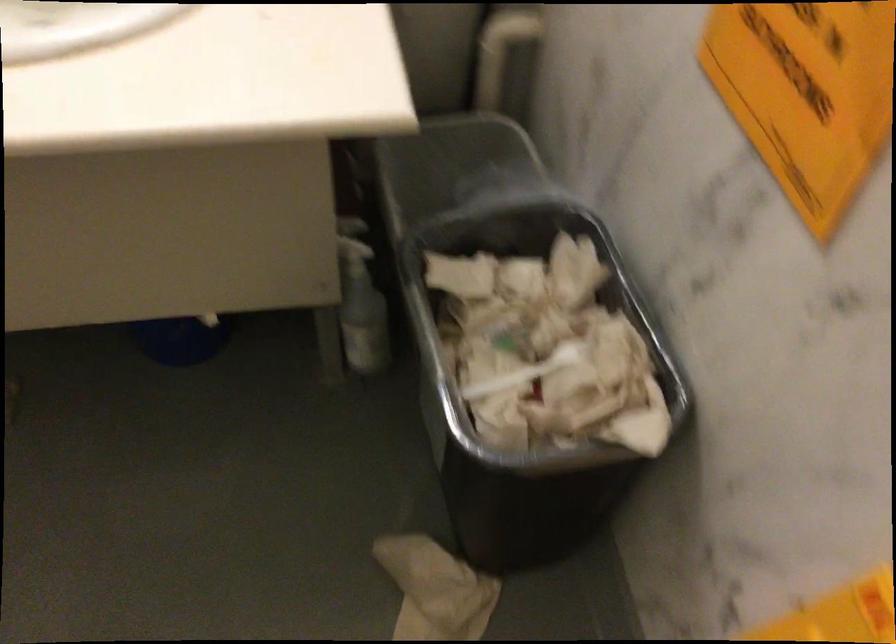
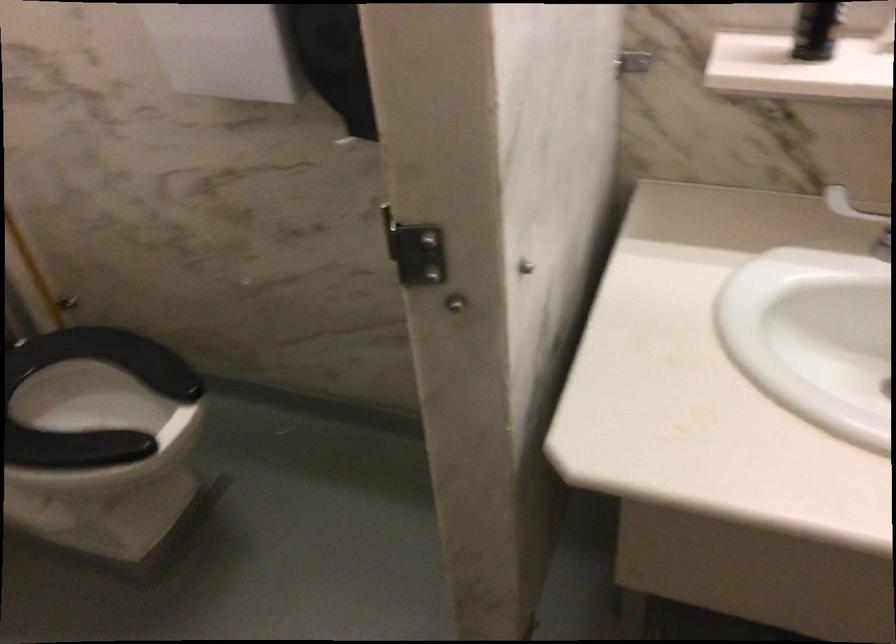
Question: The images are taken continuously from a first-person perspective. In which direction is your viewpoint rotating?

Choices:
 (A) Left
 (B) Right
 (C) Up
 (D) Down

Answer: (A)